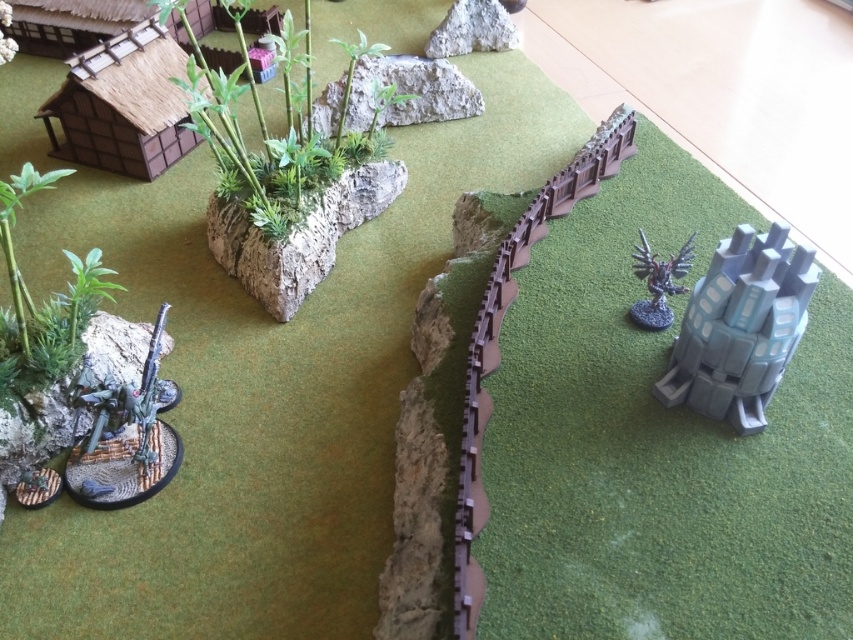
Is wooden thatched hut at upper left to the left of rough concrete rock at upper center from the viewer's perspective?

Yes, wooden thatched hut at upper left is to the left of rough concrete rock at upper center.

Between point (117, 132) and point (334, 100), which one is positioned in front?

Positioned in front is point (117, 132).

The height and width of the screenshot is (640, 853). I want to click on wooden thatched hut at upper left, so click(x=123, y=104).

Can you confirm if green leafy plant at upper left is positioned below gray stone at center?

No.

Is point (207, 108) positioned behind point (257, 273)?

That is False.

Which is behind, point (311, 115) or point (314, 262)?

The point (311, 115) is behind.

Locate an element on the screen. green leafy plant at upper left is located at coordinates (265, 125).

From the picture: Is gray stone at center above green leafy plant at left?

Yes, gray stone at center is above green leafy plant at left.

Locate an element on the screen. Image resolution: width=853 pixels, height=640 pixels. gray stone at center is located at coordinates (299, 236).

Is point (274, 296) positioned after point (96, 250)?

That is True.

This screenshot has width=853, height=640. I want to click on gray stone at center, so click(x=299, y=236).